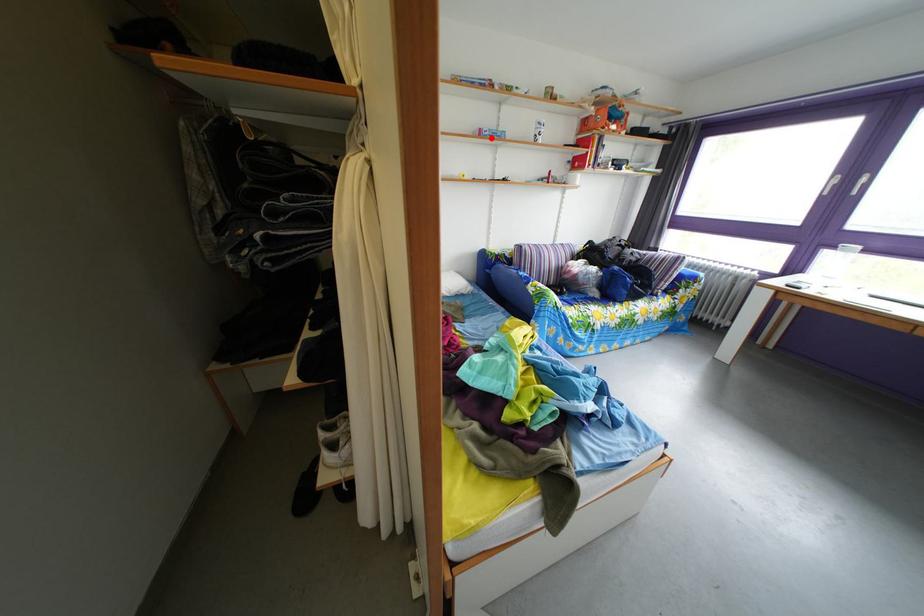
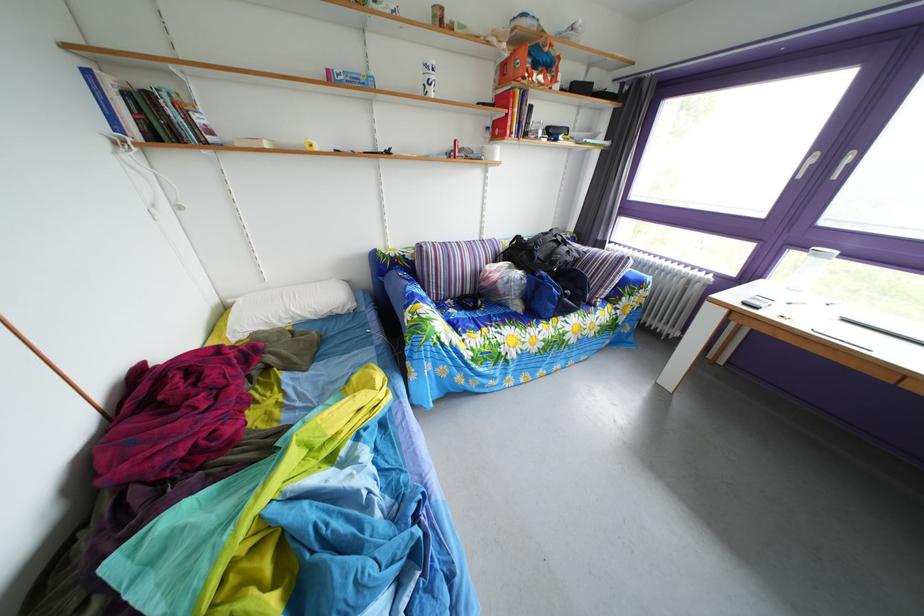
Question: A red point is marked in image1. In image2, is the corresponding 3D point closer to the camera or farther? Reply with the corresponding letter.

Choices:
 (A) The corresponding 3D point is closer.
 (B) The corresponding 3D point is farther.

Answer: (B)